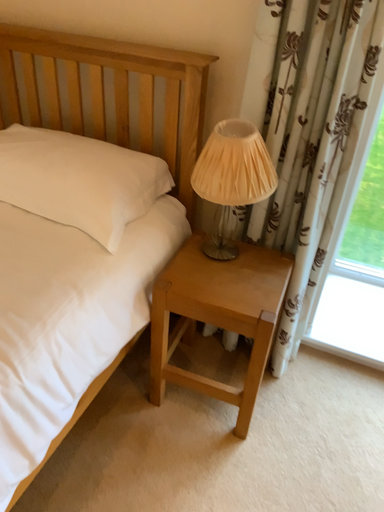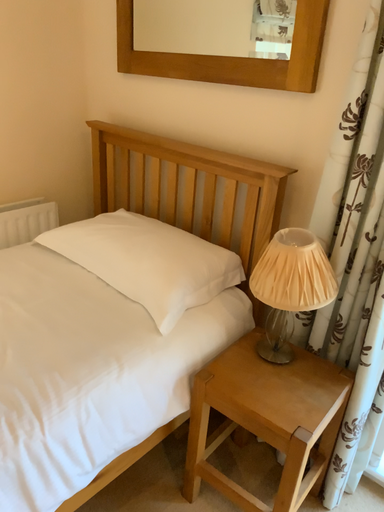
Question: How did the camera likely rotate when shooting the video?

Choices:
 (A) rotated upward
 (B) rotated downward

Answer: (A)